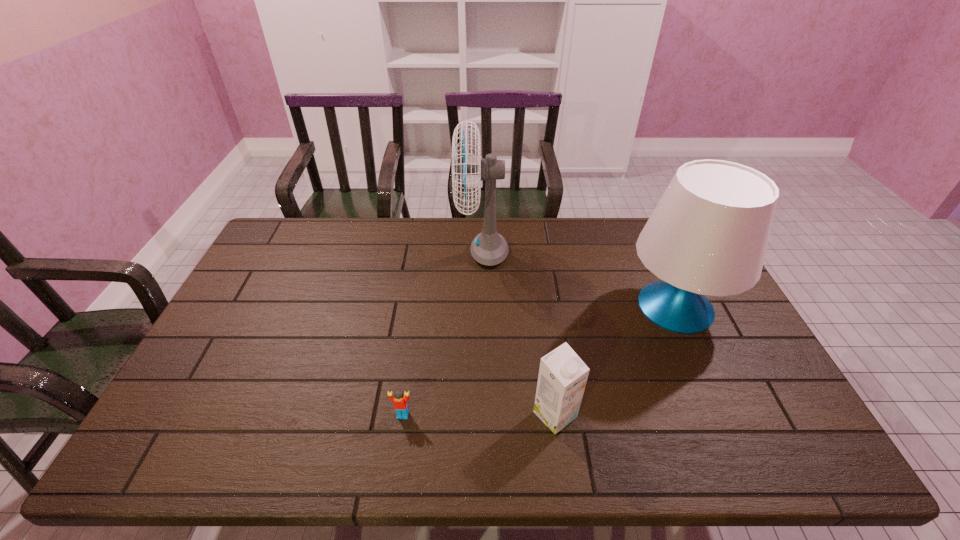
The height and width of the screenshot is (540, 960). What are the coordinates of `fan` in the screenshot? It's located at (489, 248).

Where is `table lamp`? The height and width of the screenshot is (540, 960). table lamp is located at coordinates (708, 235).

What are the coordinates of `carton` in the screenshot? It's located at (562, 378).

Where is `the third object from left to right`? This screenshot has width=960, height=540. the third object from left to right is located at coordinates pos(562,378).

Where is `the shortest object`? the shortest object is located at coordinates (400, 401).

The height and width of the screenshot is (540, 960). What are the coordinates of `Lego` in the screenshot? It's located at (400, 401).

The image size is (960, 540). What are the coordinates of `vacant area situated 0.400m on the front-facing side of the third object from right to left` in the screenshot? It's located at (344, 251).

Identify the location of vacant space located on the front-facing side of the third object from right to left. This screenshot has width=960, height=540. (363, 251).

Find the location of a particular element. The width and height of the screenshot is (960, 540). free region located 0.340m on the front-facing side of the third object from right to left is located at coordinates (360, 251).

Where is `vacant area situated on the front-facing side of the table lamp`? vacant area situated on the front-facing side of the table lamp is located at coordinates (557, 307).